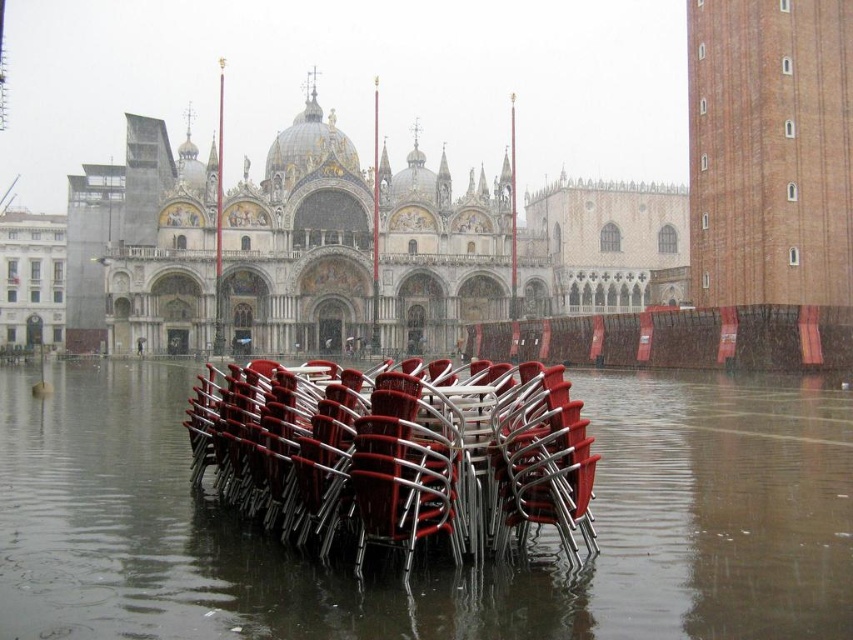
Question: Does red plastic chairs at center have a greater width compared to metallic red chairs at lower center?

Choices:
 (A) yes
 (B) no

Answer: (A)

Question: Considering the relative positions of red plastic chairs at center and metallic red chairs at lower center in the image provided, where is red plastic chairs at center located with respect to metallic red chairs at lower center?

Choices:
 (A) right
 (B) left

Answer: (A)

Question: Which object appears closest to the camera in this image?

Choices:
 (A) red plastic chairs at center
 (B) metallic red chairs at lower center

Answer: (A)

Question: Which point is farther to the camera?

Choices:
 (A) (200, 468)
 (B) (99, 541)

Answer: (A)

Question: Is red plastic chairs at center to the right of metallic red chairs at lower center from the viewer's perspective?

Choices:
 (A) yes
 (B) no

Answer: (A)